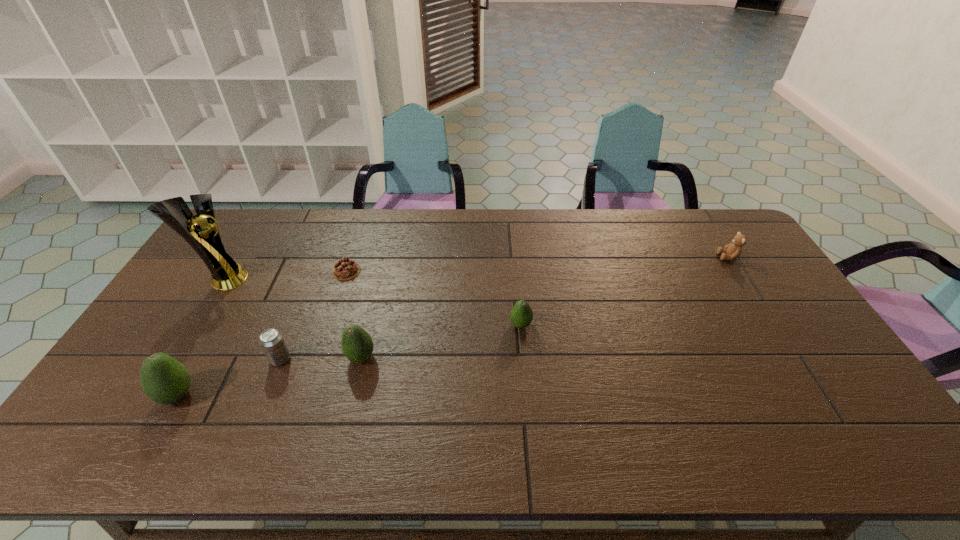
This screenshot has width=960, height=540. What are the coordinates of `avocado that stands as the second closest to the sixth shortest object` in the screenshot? It's located at (521, 315).

Identify which avocado is the nearest to the rightmost object. Please provide its 2D coordinates. Your answer should be formatted as a tuple, i.e. [(x, y)], where the tuple contains the x and y coordinates of a point satisfying the conditions above.

[(521, 315)]

This screenshot has width=960, height=540. Identify the location of free space that satisfies the following two spatial constraints: 1. at the front of the fourth farthest object, where the globe is visible; 2. on the left side of the tallest object. (193, 325).

You are a GUI agent. You are given a task and a screenshot of the screen. Output one action in this format:
    pyautogui.click(x=<x>, y=<y>)
    Task: Click on the free spot that satisfies the following two spatial constraints: 1. at the front of the award, where the globe is visible; 2. on the right side of the nearest object
    The width and height of the screenshot is (960, 540).
    Given the screenshot: What is the action you would take?
    pyautogui.click(x=150, y=395)

Where is `vacant point that satisfies the following two spatial constraints: 1. at the front of the farthest avocado, where the globe is visible; 2. on the right side of the tallest object`? This screenshot has height=540, width=960. vacant point that satisfies the following two spatial constraints: 1. at the front of the farthest avocado, where the globe is visible; 2. on the right side of the tallest object is located at coordinates 193,325.

Locate an element on the screen. The height and width of the screenshot is (540, 960). free space that satisfies the following two spatial constraints: 1. at the front of the award, where the globe is visible; 2. on the left side of the tallest avocado is located at coordinates 150,395.

Find the location of a particular element. This screenshot has height=540, width=960. vacant space that satisfies the following two spatial constraints: 1. on the back side of the nearest object; 2. on the left side of the beer can is located at coordinates (198, 359).

Image resolution: width=960 pixels, height=540 pixels. Identify the location of free space that satisfies the following two spatial constraints: 1. at the front of the award, where the globe is visible; 2. on the right side of the second farthest avocado. (173, 357).